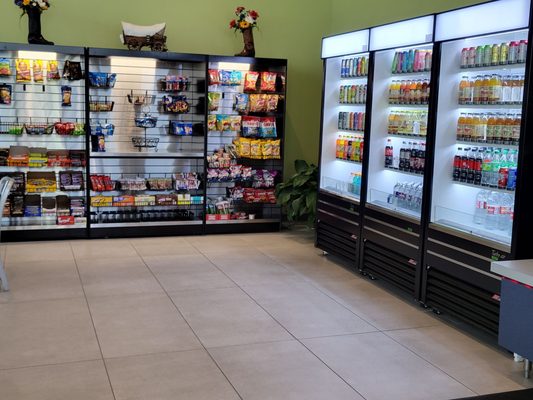
Find the location of a particular element. The height and width of the screenshot is (400, 533). vents is located at coordinates (343, 244), (387, 262), (466, 310).